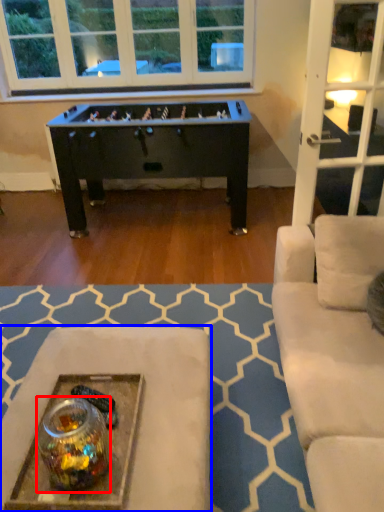
Question: Which object appears farthest to the camera in this image, glass jar (highlighted by a red box) or table (highlighted by a blue box)?

Choices:
 (A) glass jar
 (B) table

Answer: (B)